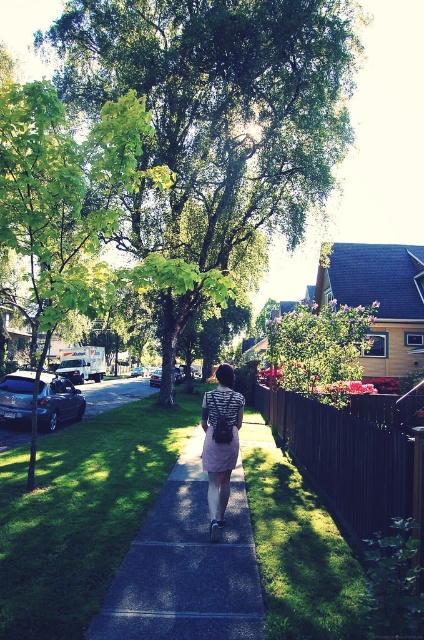
Question: Is green grass at lower left positioned in front of patterned fabric dress at center?

Choices:
 (A) yes
 (B) no

Answer: (A)

Question: Observing the image, what is the correct spatial positioning of green grass at lower left in reference to green leafy tree at left?

Choices:
 (A) right
 (B) left

Answer: (A)

Question: Estimate the real-world distances between objects in this image. Which object is closer to the green leafy tree at left?

Choices:
 (A) patterned fabric dress at center
 (B) green leafy tree at center

Answer: (A)

Question: Which point is farther to the camera?

Choices:
 (A) green grass at lower left
 (B) green leafy tree at center
 (C) patterned fabric dress at center
 (D) green leafy tree at left

Answer: (B)

Question: Which object appears farthest from the camera in this image?

Choices:
 (A) green grass at lower left
 (B) green leafy tree at left
 (C) patterned fabric dress at center

Answer: (B)

Question: Does green grass at lower left have a greater width compared to green leafy tree at left?

Choices:
 (A) no
 (B) yes

Answer: (A)